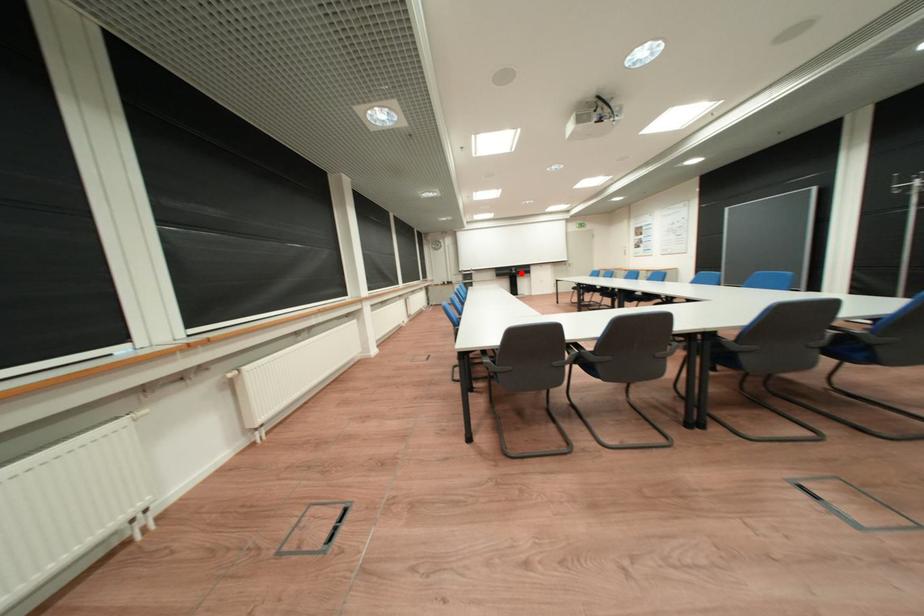
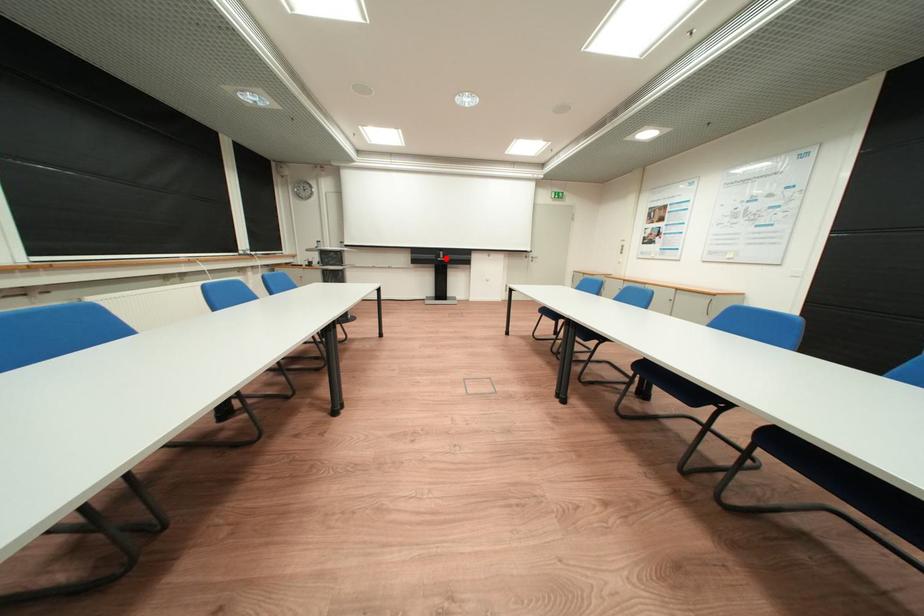
I am providing you with two images of the same scene from different viewpoints. A red point is marked on the first image and another point is marked on the second image. Does the point marked in image1 correspond to the same location as the one in image2?

Yes